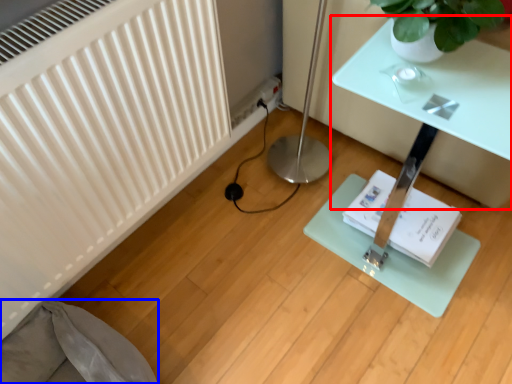
Question: Which object is closer to the camera taking this photo, table (highlighted by a red box) or swivel chair (highlighted by a blue box)?

Choices:
 (A) table
 (B) swivel chair

Answer: (B)